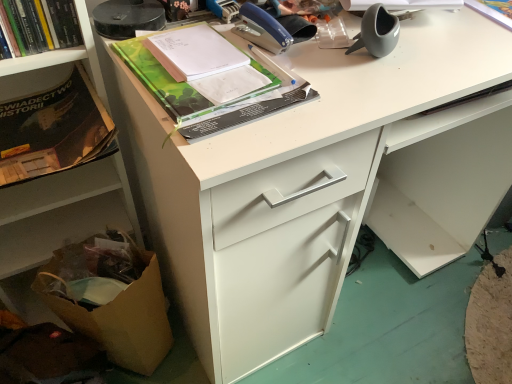
Image resolution: width=512 pixels, height=384 pixels. What are the coordinates of `free point above green matte book at upper center, the second book when ordered from left to right (from a real-world perspective)` in the screenshot? It's located at (202, 56).